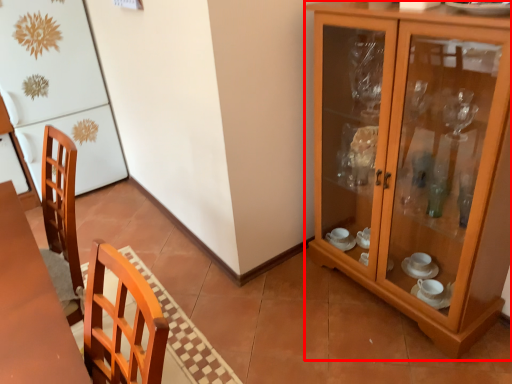
Question: From the image's perspective, where is cabinetry (annotated by the red box) located relative to fridge?

Choices:
 (A) above
 (B) below

Answer: (B)